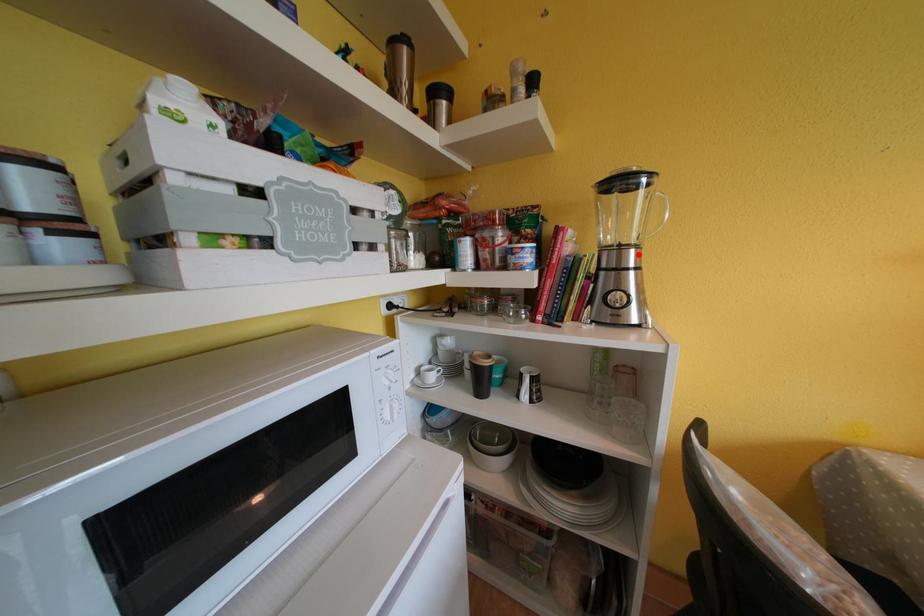
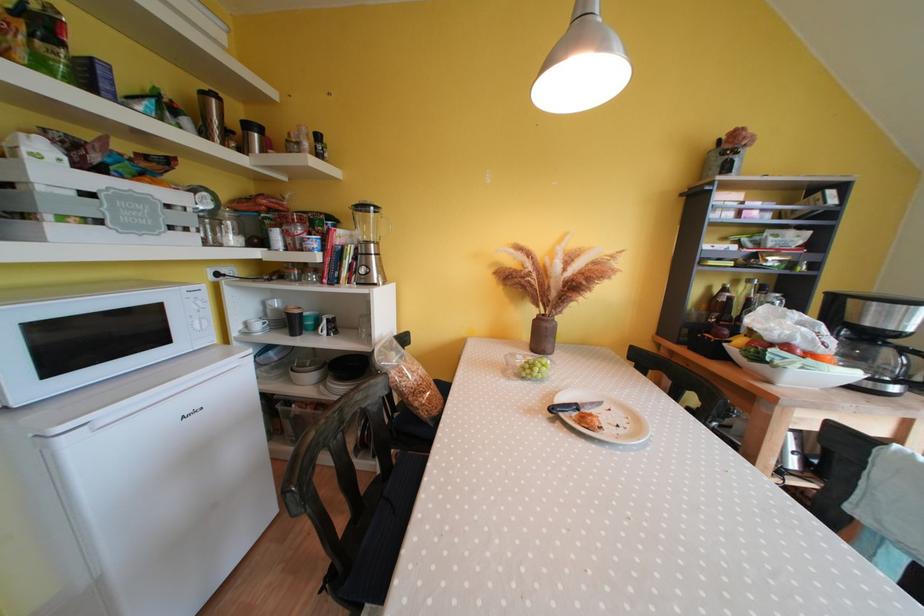
Find the pixel in the second image that matches the highlighted location in the first image.

(379, 249)